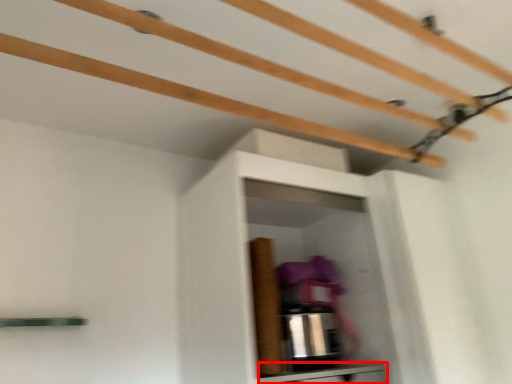
Question: From the image's perspective, where is cabinetry (annotated by the red box) located relative to shelf?

Choices:
 (A) above
 (B) below

Answer: (B)